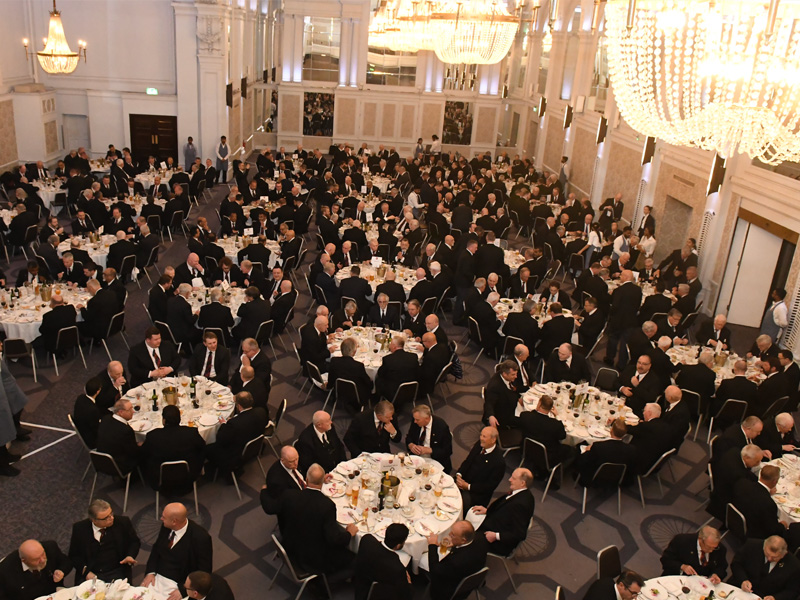
I want to click on sconces, so click(714, 185), click(642, 167), click(598, 145), click(562, 137), click(538, 120), click(226, 99), click(242, 92), click(262, 76), click(273, 74).